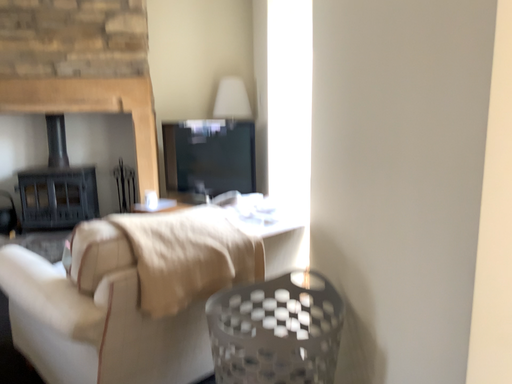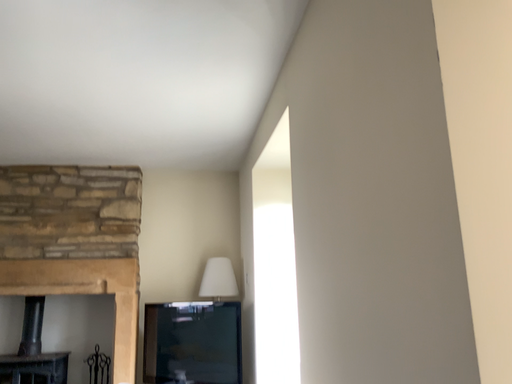
Question: Which way did the camera rotate in the video?

Choices:
 (A) rotated upward
 (B) rotated downward

Answer: (A)